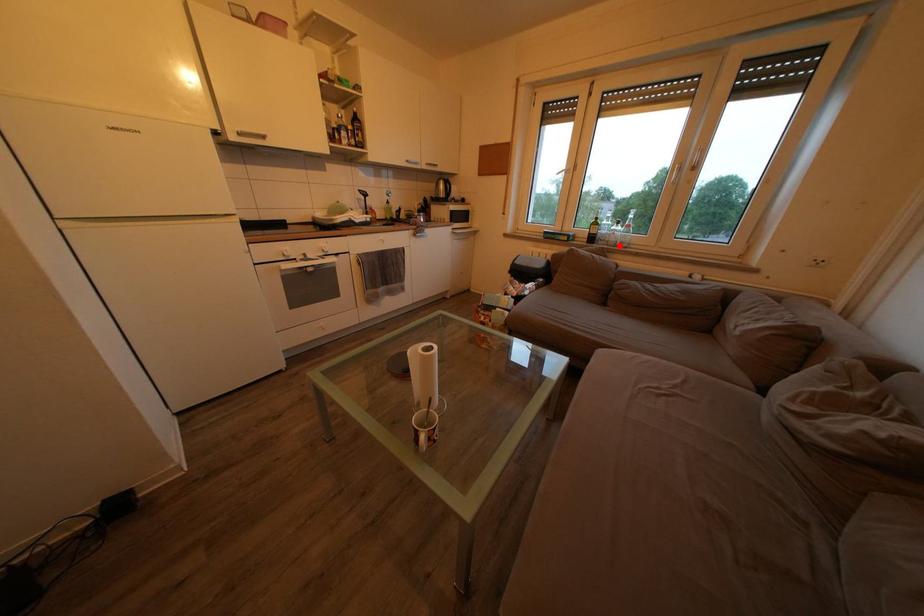
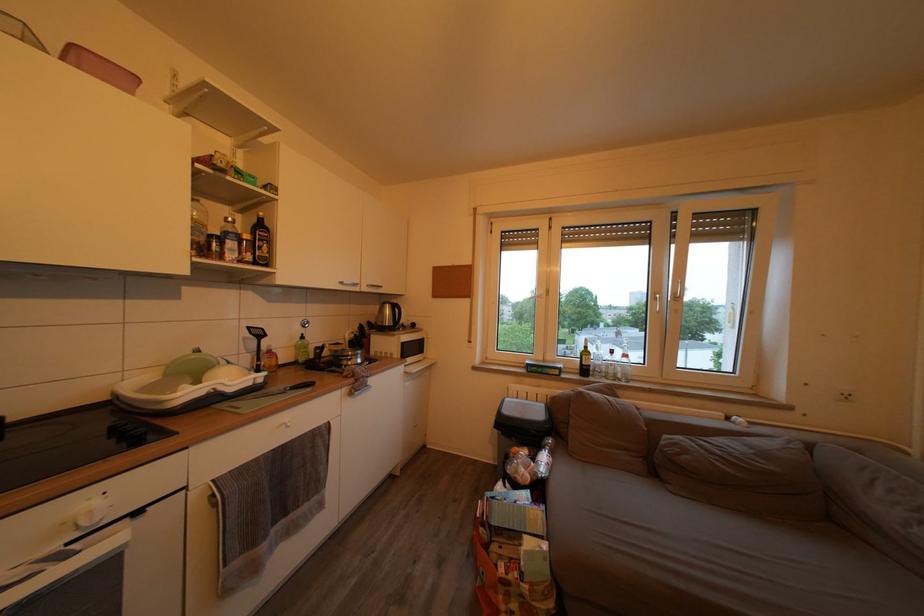
Question: A red point is marked in image1. In image2, is the corresponding 3D point closer to the camera or farther? Reply with the corresponding letter.

Choices:
 (A) The corresponding 3D point is closer.
 (B) The corresponding 3D point is farther.

Answer: (B)